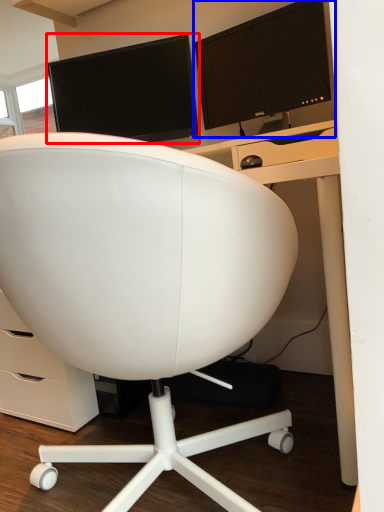
Question: Among these objects, which one is nearest to the camera, computer monitor (highlighted by a red box) or computer monitor (highlighted by a blue box)?

Choices:
 (A) computer monitor
 (B) computer monitor

Answer: (B)